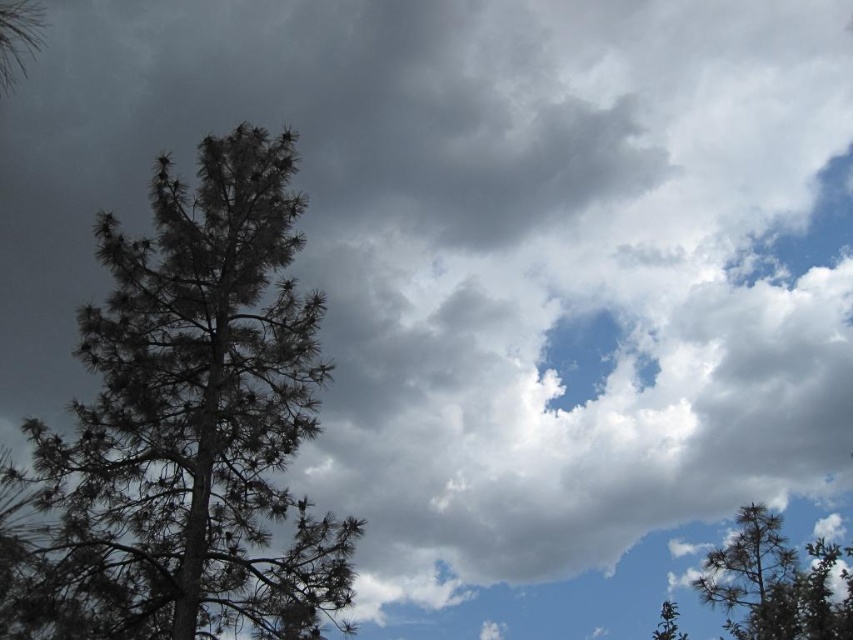
You are an ornithologist observing the pine tree at the left side of the image. You notice a specific point in the scene at coordinates point (186,429). What is located at that point?

At point (186,429) lies dark green needles at left.